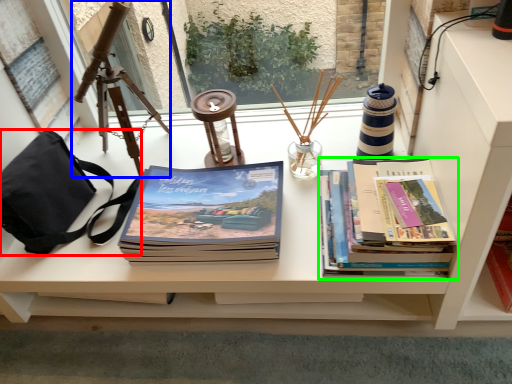
Question: Which object is positioned closest to handbag (highlighted by a red box)? Select from tripod (highlighted by a blue box) and book (highlighted by a green box).

Choices:
 (A) tripod
 (B) book

Answer: (A)